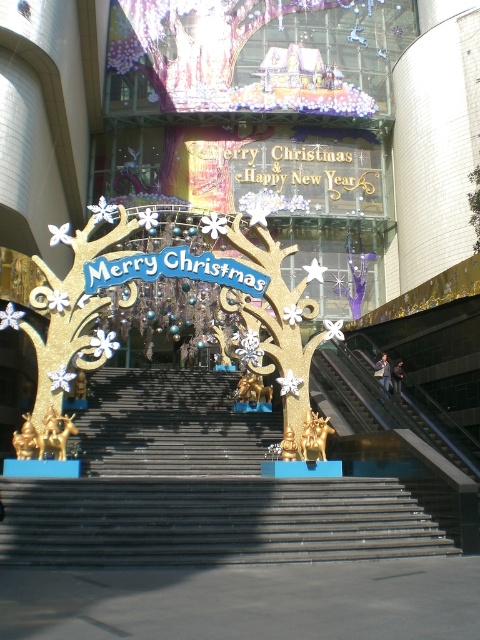
You are standing in front of the festive Christmas display at the entrance. You notice two gold trees labeled as gold glittery tree at center and gold glittering tree at center. Which one appears nearer to you?

The gold glittery tree at center appears nearer to the viewer than the gold glittering tree at center.